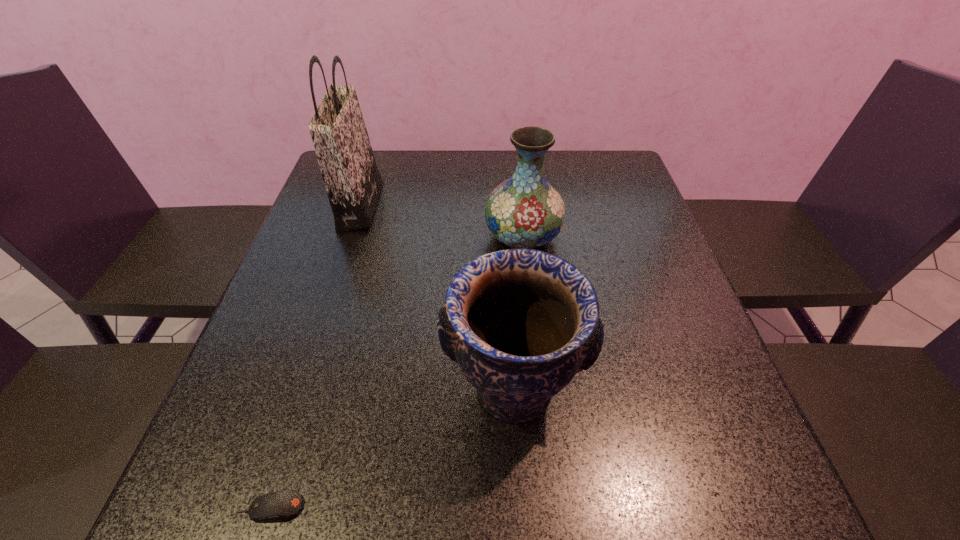
In order to click on free space that satisfies the following two spatial constraints: 1. on the front of the tallest object with the design; 2. on the left side of the vase in this screenshot , I will do `click(350, 237)`.

This screenshot has height=540, width=960. I want to click on vacant space that satisfies the following two spatial constraints: 1. on the front of the shopping bag with the design; 2. on the left side of the vase, so click(350, 237).

I want to click on free space that satisfies the following two spatial constraints: 1. on the front of the tallest object with the design; 2. on the back side of the nearest object, so click(x=263, y=508).

The image size is (960, 540). In order to click on blank space that satisfies the following two spatial constraints: 1. on the front of the shopping bag with the design; 2. on the left side of the vase in this screenshot , I will do `click(350, 237)`.